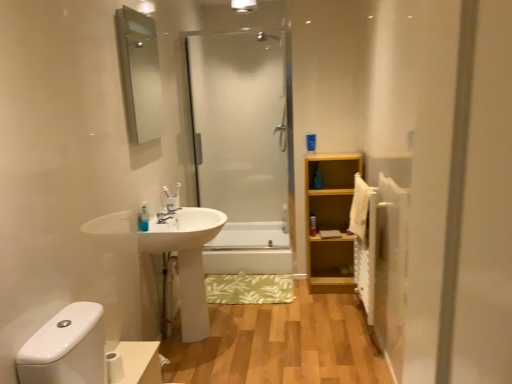
Question: Considering the relative sizes of white glossy bathtub at center and white matte toilet paper at lower left in the image provided, is white glossy bathtub at center shorter than white matte toilet paper at lower left?

Choices:
 (A) yes
 (B) no

Answer: (B)

Question: Considering the relative positions of white glossy bathtub at center and white matte toilet paper at lower left in the image provided, is white glossy bathtub at center in front of white matte toilet paper at lower left?

Choices:
 (A) yes
 (B) no

Answer: (B)

Question: From the image's perspective, would you say white glossy bathtub at center is positioned over white matte toilet paper at lower left?

Choices:
 (A) yes
 (B) no

Answer: (A)

Question: Is white glossy bathtub at center wider than white matte toilet paper at lower left?

Choices:
 (A) yes
 (B) no

Answer: (A)

Question: Would you consider white glossy bathtub at center to be distant from white matte toilet paper at lower left?

Choices:
 (A) yes
 (B) no

Answer: (A)

Question: Is white glossy bathtub at center further to camera compared to white matte toilet paper at lower left?

Choices:
 (A) yes
 (B) no

Answer: (A)

Question: Is transparent glass shower door at center at the left side of clear glass mirror at upper left?

Choices:
 (A) yes
 (B) no

Answer: (B)

Question: Is transparent glass shower door at center further to the viewer compared to clear glass mirror at upper left?

Choices:
 (A) no
 (B) yes

Answer: (B)

Question: Is transparent glass shower door at center to the right of clear glass mirror at upper left from the viewer's perspective?

Choices:
 (A) yes
 (B) no

Answer: (A)

Question: Can you confirm if transparent glass shower door at center is shorter than clear glass mirror at upper left?

Choices:
 (A) no
 (B) yes

Answer: (A)

Question: Is transparent glass shower door at center wider than clear glass mirror at upper left?

Choices:
 (A) no
 (B) yes

Answer: (B)

Question: Is transparent glass shower door at center outside clear glass mirror at upper left?

Choices:
 (A) no
 (B) yes

Answer: (B)

Question: From a real-world perspective, is clear glass mirror at upper left located higher than translucent plastic soap at left, placed as the first toiletry when sorted from front to back?

Choices:
 (A) yes
 (B) no

Answer: (A)